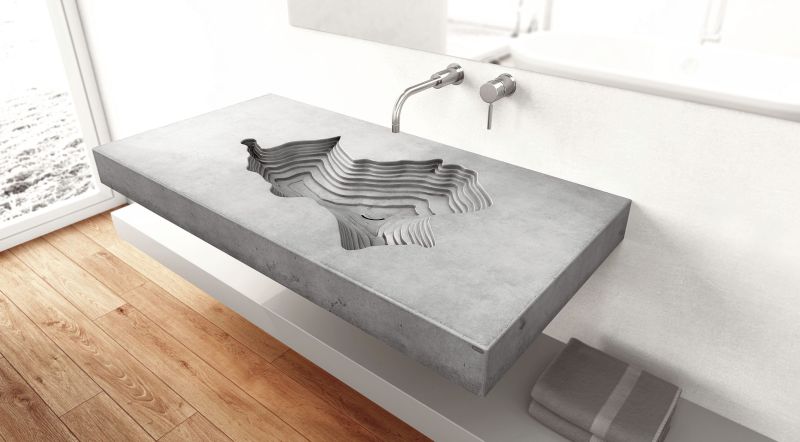
Where is `beveled sink hole`? This screenshot has width=800, height=442. beveled sink hole is located at coordinates (374, 196).